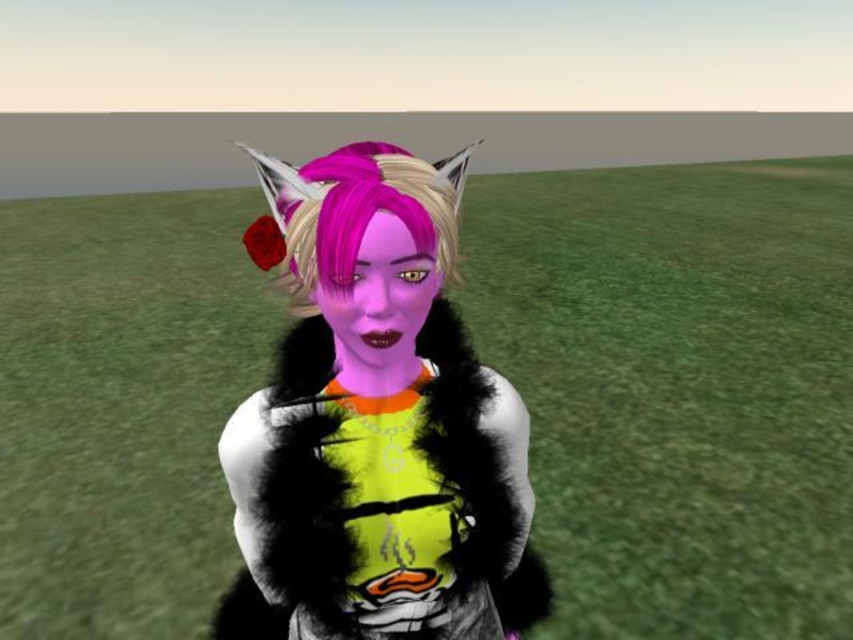
Question: Which point appears farthest from the camera in this image?

Choices:
 (A) (339, 515)
 (B) (445, 225)

Answer: (A)

Question: Does fuzzy fur vest at center come in front of pink matte hair at center?

Choices:
 (A) yes
 (B) no

Answer: (B)

Question: Which of the following is the closest to the observer?

Choices:
 (A) pink matte hair at center
 (B) fuzzy fur vest at center

Answer: (A)

Question: Is fuzzy fur vest at center below pink matte hair at center?

Choices:
 (A) yes
 (B) no

Answer: (A)

Question: In this image, where is fuzzy fur vest at center located relative to pink matte hair at center?

Choices:
 (A) above
 (B) below

Answer: (B)